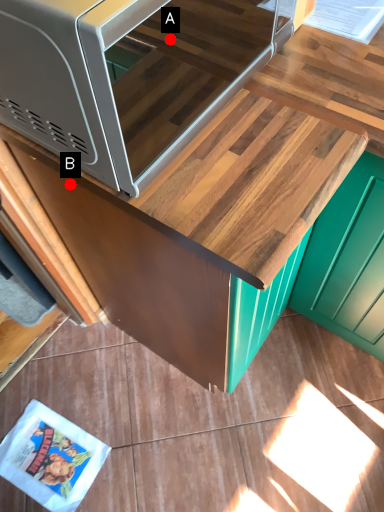
Question: Two points are circled on the image, labeled by A and B beside each circle. Which point appears farthest from the camera in this image?

Choices:
 (A) A is further
 (B) B is further

Answer: (A)